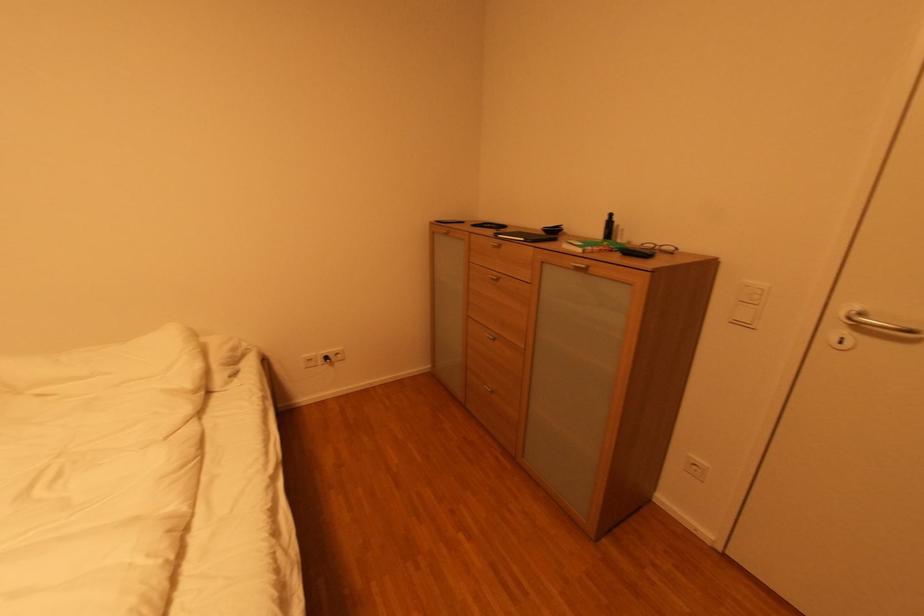
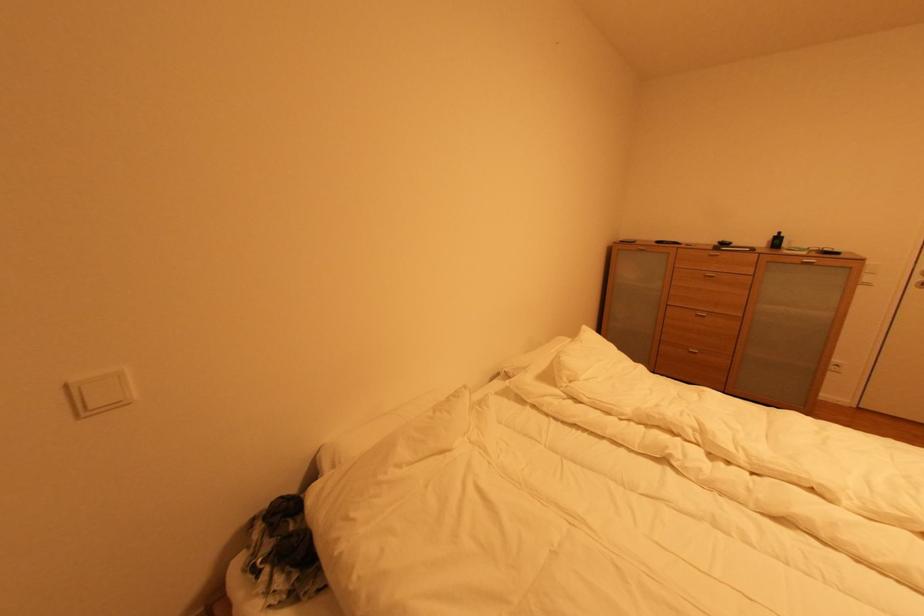
Question: What movement of the cameraman would produce the second image?

Choices:
 (A) Left
 (B) Right
 (C) Forward
 (D) Backward

Answer: (A)